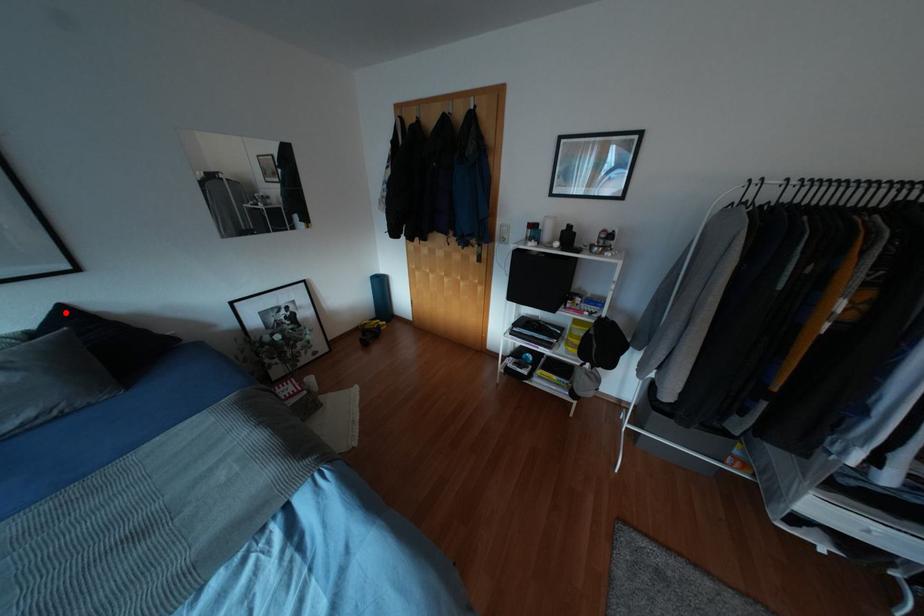
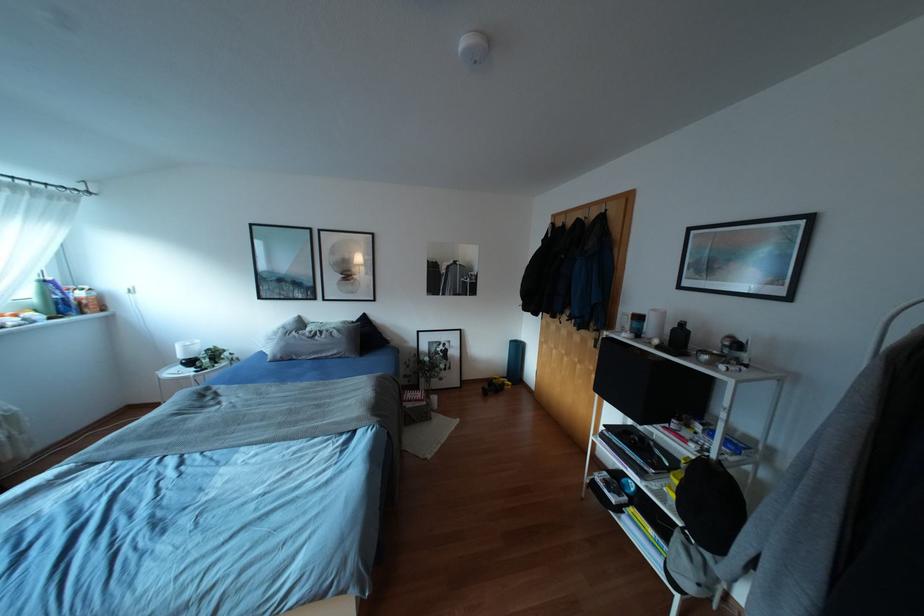
Locate, in the second image, the point that corresponds to the highlighted location in the first image.

(363, 317)